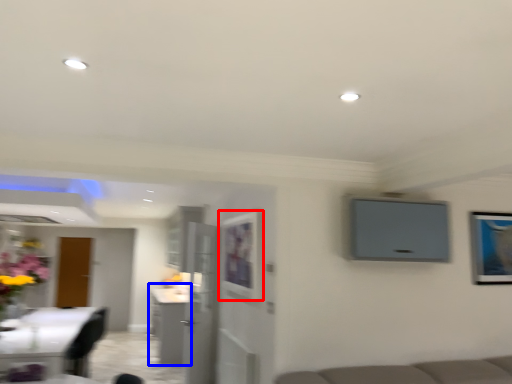
Question: Which of the following is the closest to the observer, picture frame (highlighted by a red box) or cabinetry (highlighted by a blue box)?

Choices:
 (A) picture frame
 (B) cabinetry

Answer: (A)